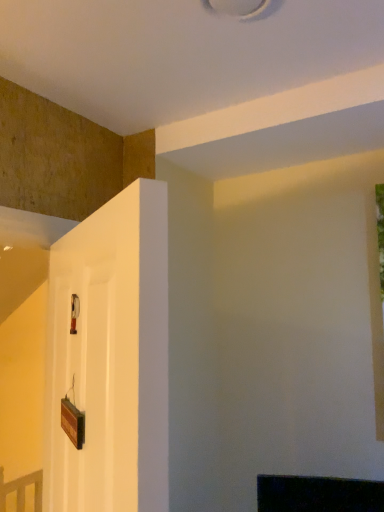
What do you see at coordinates (111, 357) in the screenshot? I see `white matte door at left` at bounding box center [111, 357].

Measure the distance between point (147,422) and camera.

They are 56.00 centimeters apart.

Locate an element on the screen. white matte door at left is located at coordinates (111, 357).

At what (x,y) coordinates should I click in order to perform the action: click on white matte door at left. Please return your answer as a coordinate pair (x, y). This screenshot has height=512, width=384. Looking at the image, I should click on (111, 357).